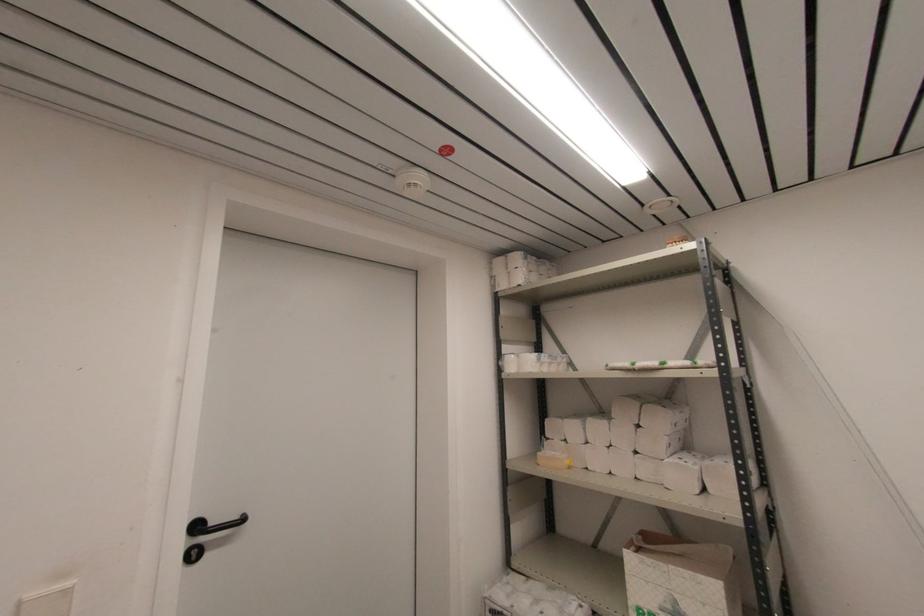
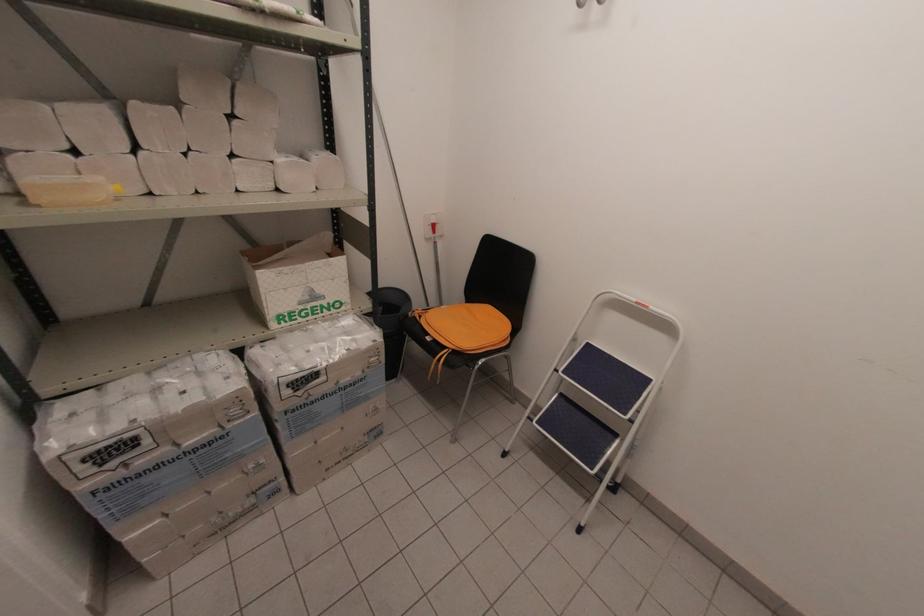
In the second image, find the point that corresponds to point 568,463 in the first image.

(116, 188)